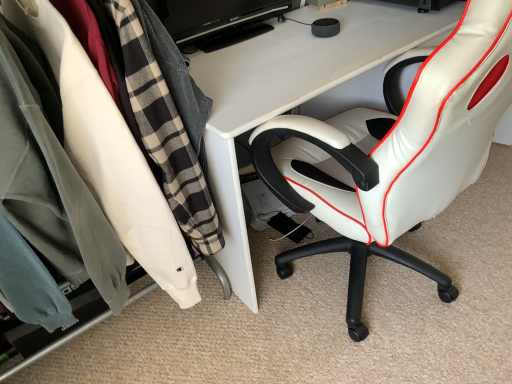
Question: Is black glossy monitor at upper center not near matte white clothing rack at left?

Choices:
 (A) no
 (B) yes

Answer: (A)

Question: From a real-world perspective, is black glossy monitor at upper center beneath matte white clothing rack at left?

Choices:
 (A) no
 (B) yes

Answer: (A)

Question: Is black glossy monitor at upper center aimed at matte white clothing rack at left?

Choices:
 (A) yes
 (B) no

Answer: (B)

Question: Is black glossy monitor at upper center turned away from matte white clothing rack at left?

Choices:
 (A) no
 (B) yes

Answer: (A)

Question: Considering the relative positions of black glossy monitor at upper center and matte white clothing rack at left in the image provided, is black glossy monitor at upper center in front of matte white clothing rack at left?

Choices:
 (A) no
 (B) yes

Answer: (A)

Question: Would you say matte white clothing rack at left is to the left or to the right of white leather chair at right in the picture?

Choices:
 (A) left
 (B) right

Answer: (A)

Question: Do you think matte white clothing rack at left is within white leather chair at right, or outside of it?

Choices:
 (A) outside
 (B) inside

Answer: (A)

Question: Is point (60, 340) positioned closer to the camera than point (481, 168)?

Choices:
 (A) closer
 (B) farther

Answer: (B)

Question: Considering their positions, is matte white clothing rack at left located in front of or behind white leather chair at right?

Choices:
 (A) front
 (B) behind

Answer: (B)

Question: In terms of width, does white leather chair at right look wider or thinner when compared to black glossy monitor at upper center?

Choices:
 (A) wide
 (B) thin

Answer: (A)

Question: Is point (450, 175) positioned closer to the camera than point (215, 21)?

Choices:
 (A) closer
 (B) farther

Answer: (A)

Question: From a real-world perspective, is white leather chair at right positioned above or below black glossy monitor at upper center?

Choices:
 (A) above
 (B) below

Answer: (B)

Question: Is white leather chair at right inside or outside of black glossy monitor at upper center?

Choices:
 (A) outside
 (B) inside

Answer: (A)

Question: In the image, is black glossy monitor at upper center positioned in front of or behind white leather chair at right?

Choices:
 (A) behind
 (B) front

Answer: (A)

Question: Considering the positions of black glossy monitor at upper center and white leather chair at right in the image, is black glossy monitor at upper center wider or thinner than white leather chair at right?

Choices:
 (A) thin
 (B) wide

Answer: (A)